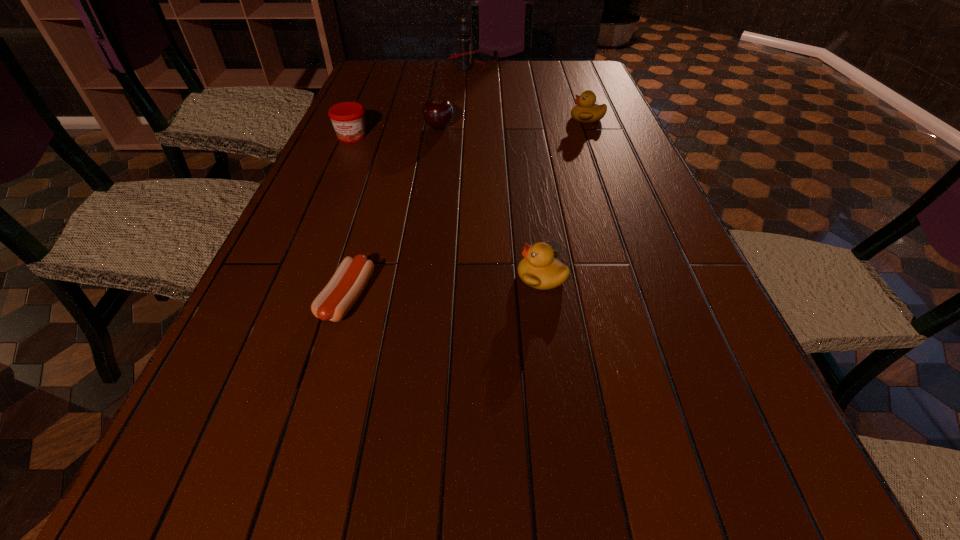
Locate an element on the screen. This screenshot has height=540, width=960. the farthest object is located at coordinates (464, 58).

You are a GUI agent. You are given a task and a screenshot of the screen. Output one action in this format:
    pyautogui.click(x=<x>, y=<y>)
    Task: Click on the tallest object
    This screenshot has width=960, height=540.
    Given the screenshot: What is the action you would take?
    pyautogui.click(x=464, y=58)

Identify the location of apple. (438, 112).

In order to click on the farther duckling in this screenshot , I will do `click(586, 111)`.

In order to click on the rightmost object in this screenshot , I will do `click(586, 111)`.

Find the location of a particular element. the leftmost object is located at coordinates (348, 118).

I want to click on the nearer duckling, so click(x=540, y=269).

Find the location of `the left duckling`. the left duckling is located at coordinates (540, 269).

At what (x,y) coordinates should I click in order to perform the action: click on the fifth object from right to left. Please return your answer as a coordinate pair (x, y). Looking at the image, I should click on (337, 298).

Identify the location of the shortest object. (337, 298).